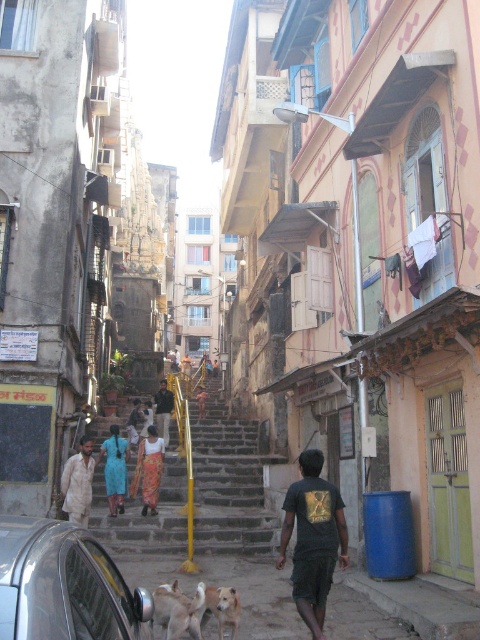
Who is lower down, white fur dog at center or light brown cotton kurta at center?

light brown cotton kurta at center is lower down.

Which is more to the right, white fur dog at center or light brown cotton kurta at center?

white fur dog at center is more to the right.

Does point (167, 588) come behind point (68, 461)?

No, (167, 588) is closer to viewer.

What are the coordinates of `white fur dog at center` in the screenshot? It's located at (178, 611).

Can you confirm if stone textured stairs at center is positioned above orange printed sari at center?

Incorrect, stone textured stairs at center is not positioned above orange printed sari at center.

Between point (169, 484) and point (132, 477), which one is positioned behind?

Positioned behind is point (169, 484).

You are a GUI agent. You are given a task and a screenshot of the screen. Output one action in this format:
    pyautogui.click(x=<x>, y=<y>)
    Task: Click on the stone textured stairs at center
    The width and height of the screenshot is (480, 640).
    Given the screenshot: What is the action you would take?
    pyautogui.click(x=228, y=483)

I want to click on shiny chrome car at lower left, so click(63, 586).

Does shiny chrome car at lower left appear over dark green t-shirt at center?

Indeed, shiny chrome car at lower left is positioned over dark green t-shirt at center.

Is point (1, 584) positioned after point (312, 554)?

No.

Where is `shiny chrome car at lower left`? shiny chrome car at lower left is located at coordinates (63, 586).